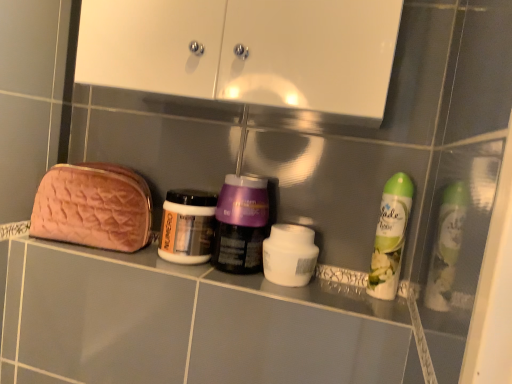
Question: Considering the relative sizes of white glossy cabinet at upper center and purple glossy jar at center, arranged as the second bottle when viewed from the left, in the image provided, is white glossy cabinet at upper center bigger than purple glossy jar at center, arranged as the second bottle when viewed from the left,?

Choices:
 (A) yes
 (B) no

Answer: (A)

Question: Is white glossy cabinet at upper center positioned behind purple glossy jar at center, which ranks as the second bottle in right-to-left order?

Choices:
 (A) no
 (B) yes

Answer: (A)

Question: Can you confirm if white glossy cabinet at upper center is positioned to the right of purple glossy jar at center, arranged as the second bottle when viewed from the left?

Choices:
 (A) no
 (B) yes

Answer: (B)

Question: Can you confirm if white glossy cabinet at upper center is taller than purple glossy jar at center, which ranks as the second bottle in right-to-left order?

Choices:
 (A) yes
 (B) no

Answer: (A)

Question: From a real-world perspective, is white glossy cabinet at upper center physically below purple glossy jar at center, which ranks as the second bottle in right-to-left order?

Choices:
 (A) yes
 (B) no

Answer: (B)

Question: Is white glossy cabinet at upper center wider than purple glossy jar at center, which ranks as the second bottle in right-to-left order?

Choices:
 (A) yes
 (B) no

Answer: (A)

Question: Is metallic silver jar at center, which is counted as the first bottle, starting from the left, not inside white glossy cabinet at upper center?

Choices:
 (A) no
 (B) yes

Answer: (B)

Question: Considering the relative sizes of metallic silver jar at center, which ranks as the 3th bottle in right-to-left order, and white glossy cabinet at upper center in the image provided, is metallic silver jar at center, which ranks as the 3th bottle in right-to-left order, thinner than white glossy cabinet at upper center?

Choices:
 (A) yes
 (B) no

Answer: (A)

Question: Does metallic silver jar at center, which is counted as the first bottle, starting from the left, have a smaller size compared to white glossy cabinet at upper center?

Choices:
 (A) no
 (B) yes

Answer: (B)

Question: Is metallic silver jar at center, which ranks as the 3th bottle in right-to-left order, to the left of white glossy cabinet at upper center from the viewer's perspective?

Choices:
 (A) yes
 (B) no

Answer: (A)

Question: Is metallic silver jar at center, which ranks as the 3th bottle in right-to-left order, wider than white glossy cabinet at upper center?

Choices:
 (A) no
 (B) yes

Answer: (A)

Question: Is metallic silver jar at center, which is counted as the first bottle, starting from the left, behind white glossy cabinet at upper center?

Choices:
 (A) yes
 (B) no

Answer: (A)

Question: Is white matte jar at center further to camera compared to metallic silver jar at center, which ranks as the 3th bottle in right-to-left order?

Choices:
 (A) no
 (B) yes

Answer: (A)